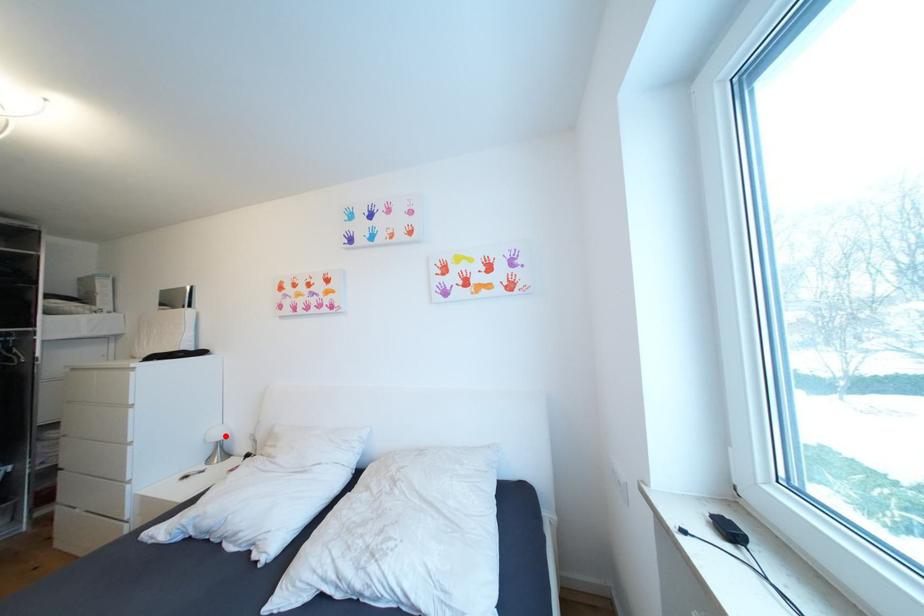
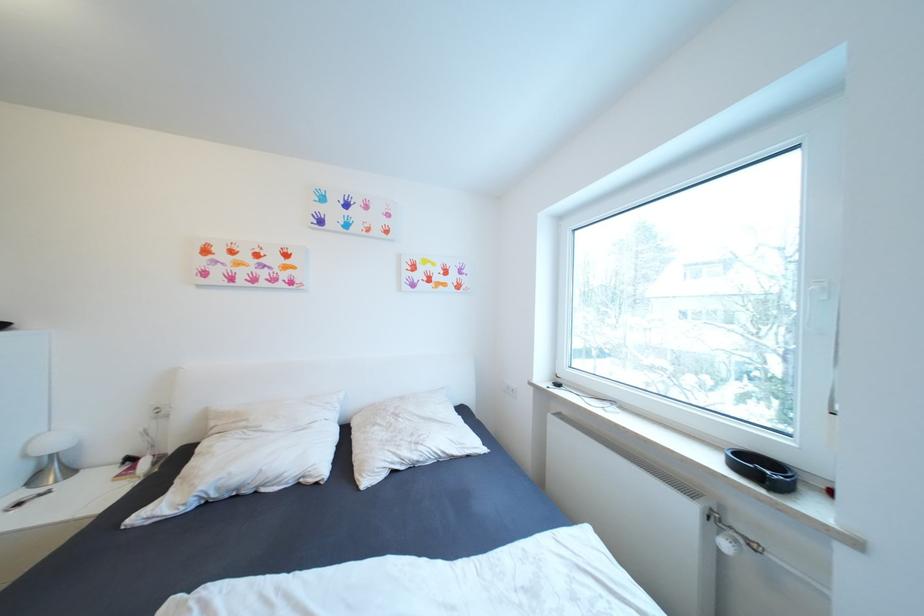
Find the pixel in the second image that matches the highlighted location in the first image.

(63, 445)